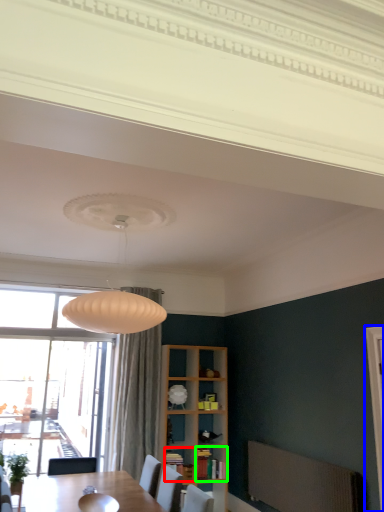
Question: Considering the real-world distances, which object is farthest from shelf (highlighted by a red box)? screen door (highlighted by a blue box) or cabinet (highlighted by a green box)?

Choices:
 (A) screen door
 (B) cabinet

Answer: (A)